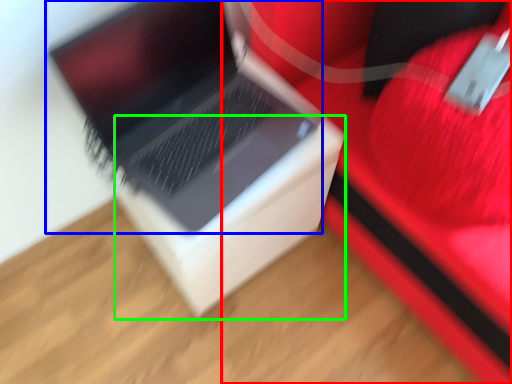
Question: Based on their relative distances, which object is nearer to furniture (highlighted by a red box)? Choose from laptop (highlighted by a blue box) and cardboard box (highlighted by a green box).

Choices:
 (A) laptop
 (B) cardboard box

Answer: (B)